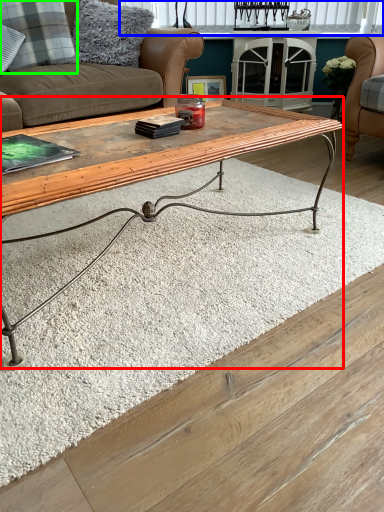
Question: Which object is positioned farthest from coffee table (highlighted by a red box)? Select from window (highlighted by a blue box) and pillow (highlighted by a green box).

Choices:
 (A) window
 (B) pillow

Answer: (A)